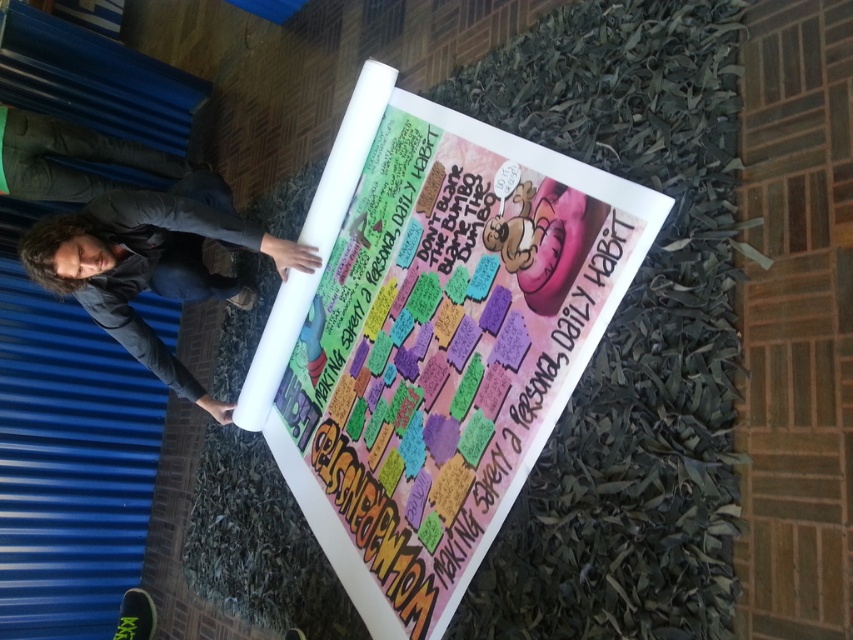
Question: Among these objects, which one is farthest from the camera?

Choices:
 (A) multicolored paperboard at center
 (B) dark gray jacket at lower left

Answer: (B)

Question: Which object appears closest to the camera in this image?

Choices:
 (A) multicolored paperboard at center
 (B) dark gray jacket at lower left

Answer: (A)

Question: Is multicolored paperboard at center thinner than dark gray jacket at lower left?

Choices:
 (A) yes
 (B) no

Answer: (B)

Question: Can you confirm if multicolored paperboard at center is thinner than dark gray jacket at lower left?

Choices:
 (A) no
 (B) yes

Answer: (A)

Question: Can you confirm if multicolored paperboard at center is wider than dark gray jacket at lower left?

Choices:
 (A) no
 (B) yes

Answer: (B)